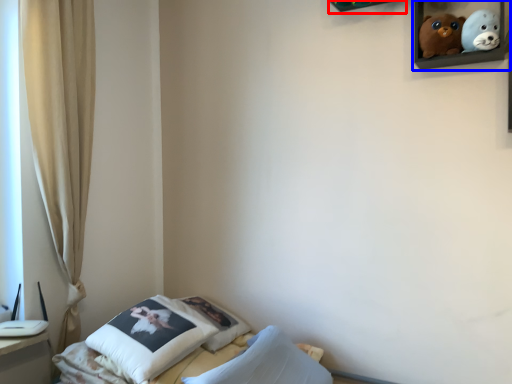
Question: Which object appears farthest to the camera in this image, shelf (highlighted by a red box) or picture frame (highlighted by a blue box)?

Choices:
 (A) shelf
 (B) picture frame

Answer: (A)